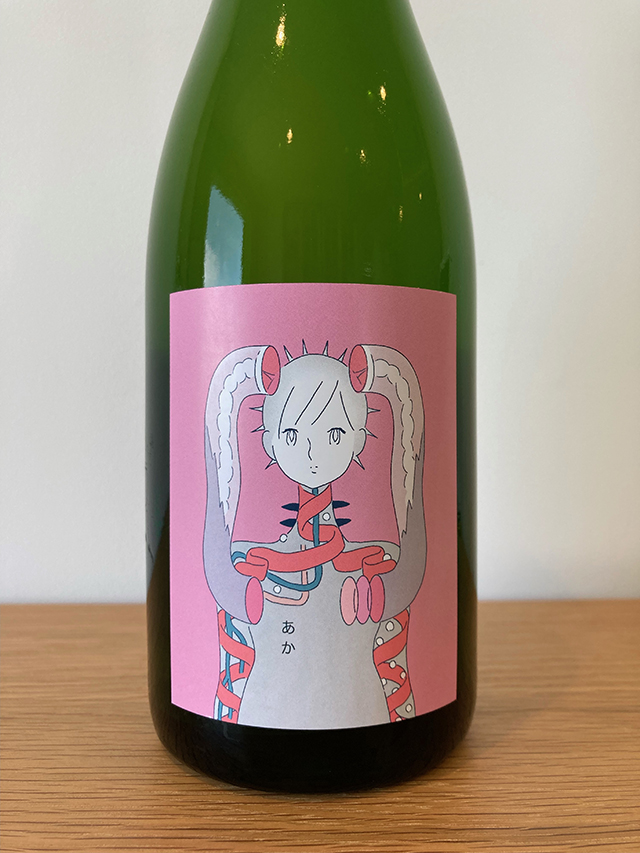
The image size is (640, 853). I want to click on green bottle, so click(313, 175).